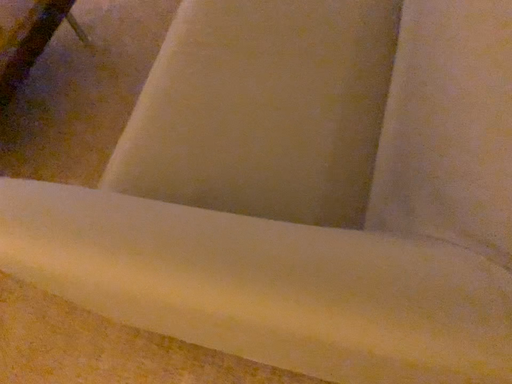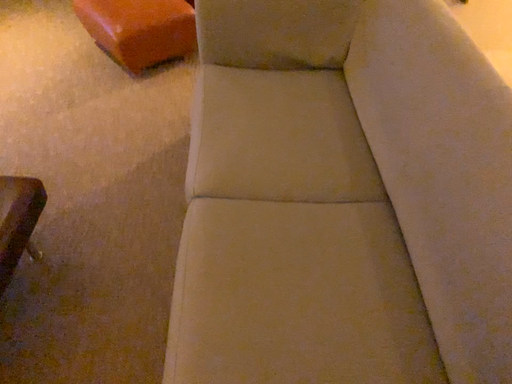
Question: How did the camera likely rotate when shooting the video?

Choices:
 (A) rotated downward
 (B) rotated upward

Answer: (B)